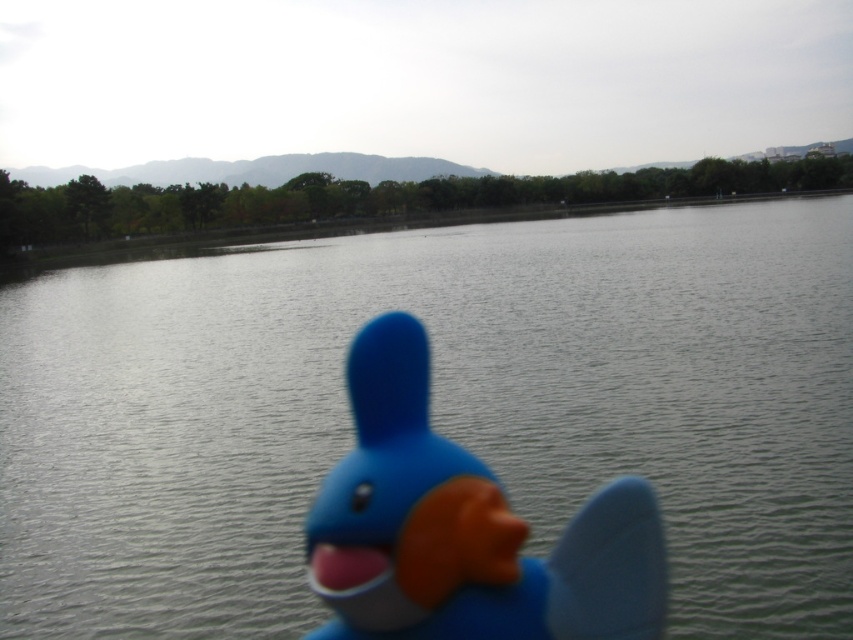
Question: Is smooth gray water at center to the right of blue rubber duck at center from the viewer's perspective?

Choices:
 (A) yes
 (B) no

Answer: (A)

Question: Which point is closer to the camera?

Choices:
 (A) (778, 452)
 (B) (636, 529)

Answer: (B)

Question: Which of the following is the closest to the observer?

Choices:
 (A) blue rubber duck at center
 (B) smooth gray water at center

Answer: (A)

Question: Which of the following is the farthest from the observer?

Choices:
 (A) (604, 568)
 (B) (160, 618)

Answer: (B)

Question: Is smooth gray water at center above blue rubber duck at center?

Choices:
 (A) yes
 (B) no

Answer: (A)

Question: Is smooth gray water at center to the right of blue rubber duck at center from the viewer's perspective?

Choices:
 (A) yes
 (B) no

Answer: (A)